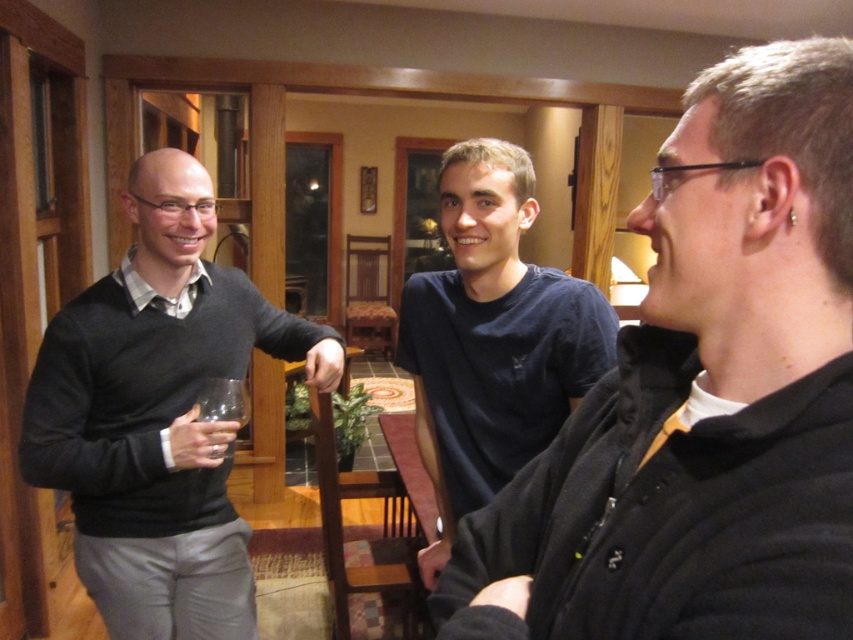
Question: Which point is farther to the camera?

Choices:
 (A) dark gray sweater at left
 (B) transparent glass at left
 (C) black matte shirt at upper right
 (D) dark blue t-shirt at center

Answer: (B)

Question: Can you confirm if black matte shirt at upper right is positioned to the right of dark gray sweater at left?

Choices:
 (A) yes
 (B) no

Answer: (A)

Question: Is dark gray sweater at left positioned before transparent glass at left?

Choices:
 (A) no
 (B) yes

Answer: (B)

Question: Among these objects, which one is farthest from the camera?

Choices:
 (A) dark blue t-shirt at center
 (B) dark gray sweater at left
 (C) transparent glass at left
 (D) black matte shirt at upper right

Answer: (C)

Question: Which point appears closest to the camera in this image?

Choices:
 (A) (202, 417)
 (B) (224, 621)
 (C) (792, 589)
 (D) (469, 339)

Answer: (C)

Question: Can you confirm if dark gray sweater at left is smaller than dark blue t-shirt at center?

Choices:
 (A) no
 (B) yes

Answer: (A)